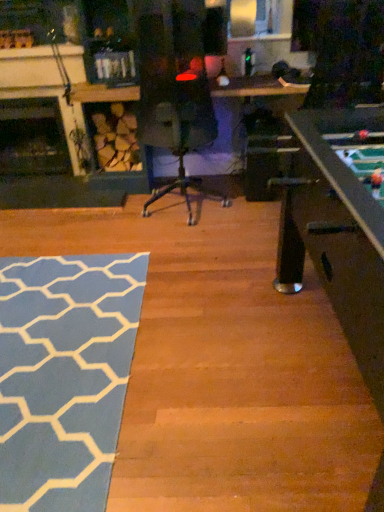
Question: Is dark wood fireplace at left, the 2th fireplace viewed from the back, wider or thinner than dark wood fireplace at left, which is counted as the 1th fireplace, starting from the back?

Choices:
 (A) wide
 (B) thin

Answer: (B)

Question: Considering their positions, is dark wood fireplace at left, the 2th fireplace viewed from the back, located in front of or behind dark wood fireplace at left, which is counted as the 1th fireplace, starting from the back?

Choices:
 (A) front
 (B) behind

Answer: (A)

Question: Which is farther from the blue textured rug at lower left?

Choices:
 (A) dark wood fireplace at left, which is counted as the 1th fireplace, starting from the back
 (B) dark wood fireplace at left, the 2th fireplace viewed from the back

Answer: (A)

Question: Which of these objects is positioned closest to the blue textured rug at lower left?

Choices:
 (A) dark wood fireplace at left, the first fireplace when ordered from front to back
 (B) dark wood fireplace at left, acting as the 2th fireplace starting from the front

Answer: (A)